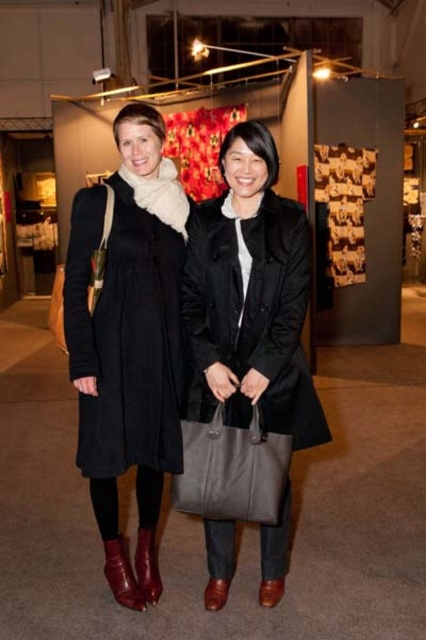
Looking at this image, you are standing at the point with coordinates point(75, 209) and want to walk to the exit located at point(284, 221). Is there any obstacle between your current position and the exit?

Point(75, 209) is behind point(284, 221), so there is an obstacle between your current position and the exit.

You are a photographer setting up for a group photo. You need to ensure that both the black matte coat at center and the leather boot at lower left are visible in the frame. Based on their positions, which object should be closer to the camera?

The black matte coat at center is in front of the leather boot at lower left, so the black matte coat at center is closer to the camera.